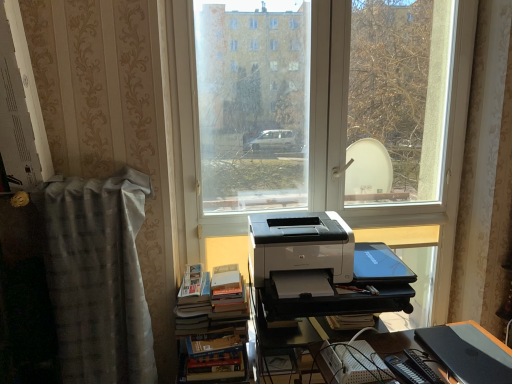
Question: In terms of size, does black plastic register at lower right, the second register positioned from the left, appear bigger or smaller than hardcover books at center-left?

Choices:
 (A) small
 (B) big

Answer: (A)

Question: Looking at their shapes, would you say black plastic register at lower right, the second register positioned from the top, is wider or thinner than hardcover books at center-left?

Choices:
 (A) wide
 (B) thin

Answer: (B)

Question: Considering the real-world distances, which object is farthest from the hardcover book at lower center?

Choices:
 (A) gray textured curtain at left
 (B) black plastic register at lower right, the second register positioned from the top
 (C) hardcover books at center-left
 (D) white plastic printer at center
 (E) white glossy printer at center

Answer: (A)

Question: Estimate the real-world distances between objects in this image. Which object is farther from the gray textured curtain at left?

Choices:
 (A) hardcover book at lower center
 (B) white plastic printer at center
 (C) hardcover books at center-left
 (D) black plastic register at lower right, the second register positioned from the left
 (E) blue plastic laptop at center, which is the first register from left to right

Answer: (D)